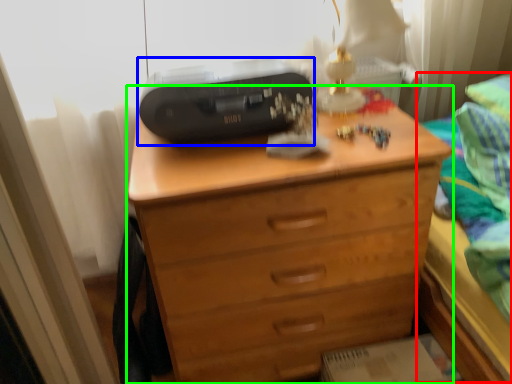
Question: Which object is positioned closest to bed (highlighted by a red box)? Select from printer (highlighted by a blue box) and chest of drawers (highlighted by a green box).

Choices:
 (A) printer
 (B) chest of drawers

Answer: (B)